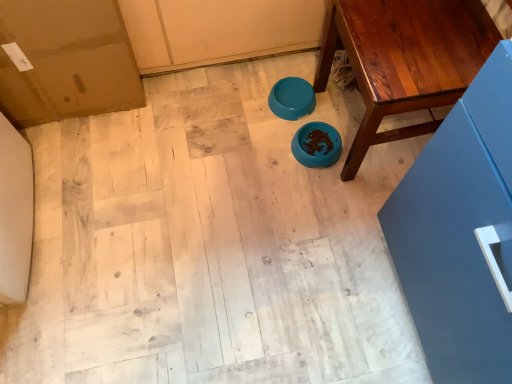
Question: Is blue matte bowl at center, marked as the 1th bowl in a bottom-to-top arrangement, to the left of teal glossy bowl at center, the first bowl when ordered from top to bottom, from the viewer's perspective?

Choices:
 (A) yes
 (B) no

Answer: (B)

Question: From a real-world perspective, is blue matte bowl at center, marked as the 1th bowl in a bottom-to-top arrangement, under teal glossy bowl at center, which appears as the second bowl when ordered from the bottom?

Choices:
 (A) no
 (B) yes

Answer: (A)

Question: From a real-world perspective, is blue matte bowl at center, the second bowl in the top-to-bottom sequence, over teal glossy bowl at center, the first bowl when ordered from top to bottom?

Choices:
 (A) yes
 (B) no

Answer: (A)

Question: Can you confirm if blue matte bowl at center, the second bowl in the top-to-bottom sequence, is bigger than teal glossy bowl at center, which appears as the second bowl when ordered from the bottom?

Choices:
 (A) no
 (B) yes

Answer: (B)

Question: Is blue matte bowl at center, marked as the 1th bowl in a bottom-to-top arrangement, closer to the viewer compared to teal glossy bowl at center, the first bowl when ordered from top to bottom?

Choices:
 (A) no
 (B) yes

Answer: (B)

Question: Is blue matte bowl at center, marked as the 1th bowl in a bottom-to-top arrangement, bigger or smaller than teal glossy bowl at center, the first bowl when ordered from top to bottom?

Choices:
 (A) small
 (B) big

Answer: (B)

Question: From the image's perspective, is blue matte bowl at center, marked as the 1th bowl in a bottom-to-top arrangement, above or below teal glossy bowl at center, which appears as the second bowl when ordered from the bottom?

Choices:
 (A) above
 (B) below

Answer: (B)

Question: Does point (340, 150) appear closer or farther from the camera than point (302, 109)?

Choices:
 (A) closer
 (B) farther

Answer: (A)

Question: Visually, is blue matte bowl at center, marked as the 1th bowl in a bottom-to-top arrangement, positioned to the left or to the right of teal glossy bowl at center, which appears as the second bowl when ordered from the bottom?

Choices:
 (A) right
 (B) left

Answer: (A)

Question: From their relative heights in the image, would you say wooden table at center is taller or shorter than teal glossy bowl at center, which appears as the second bowl when ordered from the bottom?

Choices:
 (A) short
 (B) tall

Answer: (B)

Question: Looking at the image, does wooden table at center seem bigger or smaller compared to teal glossy bowl at center, the first bowl when ordered from top to bottom?

Choices:
 (A) big
 (B) small

Answer: (A)

Question: From a real-world perspective, relative to teal glossy bowl at center, the first bowl when ordered from top to bottom, is wooden table at center vertically above or below?

Choices:
 (A) below
 (B) above

Answer: (B)

Question: Considering the positions of wooden table at center and teal glossy bowl at center, the first bowl when ordered from top to bottom, in the image, is wooden table at center wider or thinner than teal glossy bowl at center, the first bowl when ordered from top to bottom,?

Choices:
 (A) wide
 (B) thin

Answer: (A)

Question: Considering the relative positions of teal glossy bowl at center, which appears as the second bowl when ordered from the bottom, and blue matte bowl at center, the second bowl in the top-to-bottom sequence, in the image provided, is teal glossy bowl at center, which appears as the second bowl when ordered from the bottom, to the left or to the right of blue matte bowl at center, the second bowl in the top-to-bottom sequence,?

Choices:
 (A) right
 (B) left

Answer: (B)

Question: From the image's perspective, is teal glossy bowl at center, which appears as the second bowl when ordered from the bottom, located above or below blue matte bowl at center, the second bowl in the top-to-bottom sequence?

Choices:
 (A) above
 (B) below

Answer: (A)